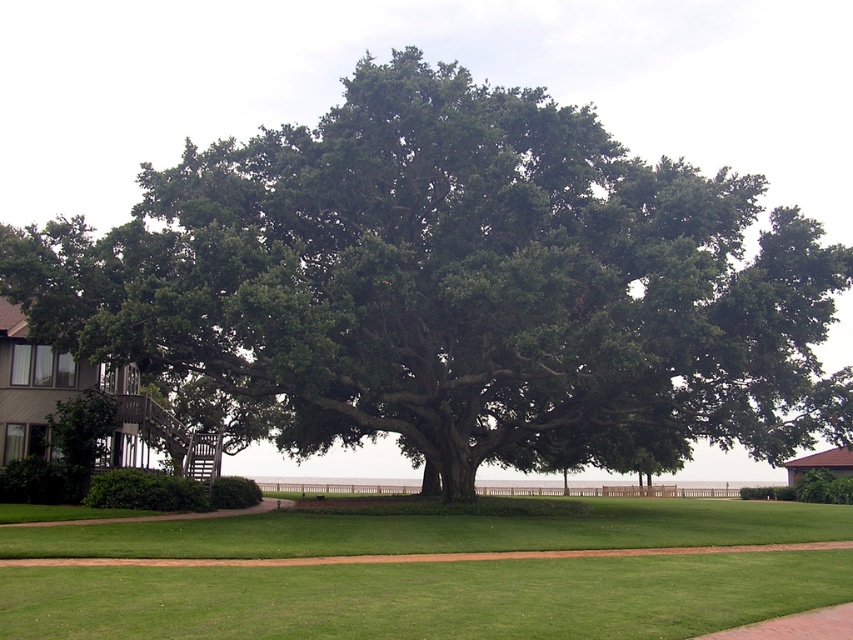
Question: Which point appears closest to the camera in this image?

Choices:
 (A) (264, 595)
 (B) (691, 310)

Answer: (A)

Question: Is green leafy tree at center wider than green smooth grass at center?

Choices:
 (A) yes
 (B) no

Answer: (A)

Question: Can you confirm if green leafy tree at center is positioned to the right of green smooth grass at center?

Choices:
 (A) yes
 (B) no

Answer: (B)

Question: Which object is farther from the camera taking this photo?

Choices:
 (A) green smooth grass at center
 (B) green leafy tree at center

Answer: (B)

Question: Is green leafy tree at center thinner than green smooth grass at center?

Choices:
 (A) yes
 (B) no

Answer: (B)